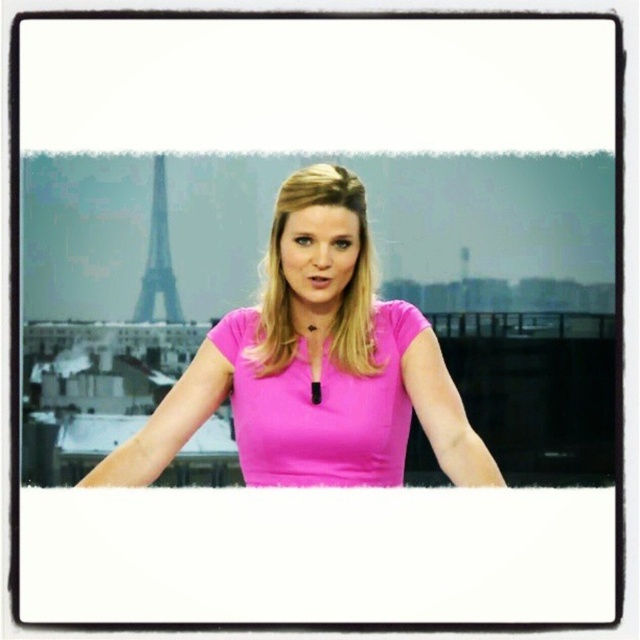
Who is lower down, matte pink dress at center or metallic gray eiffel tower at upper left?

Positioned lower is matte pink dress at center.

Does matte pink dress at center have a smaller size compared to metallic gray eiffel tower at upper left?

Incorrect, matte pink dress at center is not smaller in size than metallic gray eiffel tower at upper left.

At what (x,y) coordinates should I click in order to perform the action: click on matte pink dress at center. Please return your answer as a coordinate pair (x, y). This screenshot has height=640, width=640. Looking at the image, I should click on (321, 408).

Locate an element on the screen. The width and height of the screenshot is (640, 640). matte pink dress at center is located at coordinates (321, 408).

Is pink matte dress at center wider than matte pink dress at center?

Correct, the width of pink matte dress at center exceeds that of matte pink dress at center.

What do you see at coordinates (314, 365) in the screenshot? I see `pink matte dress at center` at bounding box center [314, 365].

You are a GUI agent. You are given a task and a screenshot of the screen. Output one action in this format:
    pyautogui.click(x=<x>, y=<y>)
    Task: Click on the pink matte dress at center
    The height and width of the screenshot is (640, 640).
    Given the screenshot: What is the action you would take?
    pyautogui.click(x=314, y=365)

Which is behind, point (269, 470) or point (150, 212)?

Point (150, 212)

Can you confirm if pink matte dress at center is wider than metallic gray eiffel tower at upper left?

Correct, the width of pink matte dress at center exceeds that of metallic gray eiffel tower at upper left.

Image resolution: width=640 pixels, height=640 pixels. What do you see at coordinates (314, 365) in the screenshot? I see `pink matte dress at center` at bounding box center [314, 365].

Locate an element on the screen. The image size is (640, 640). pink matte dress at center is located at coordinates (314, 365).